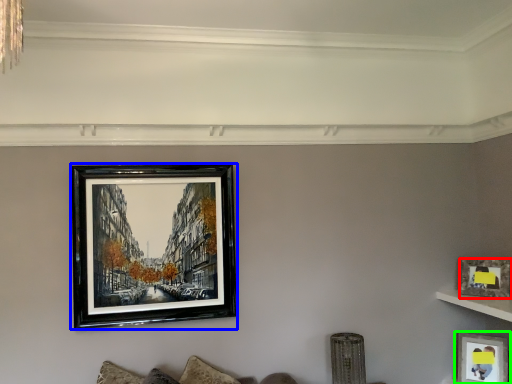
Question: Which is nearer to the picture frame (highlighted by a red box)? picture frame (highlighted by a blue box) or picture frame (highlighted by a green box).

Choices:
 (A) picture frame
 (B) picture frame

Answer: (B)